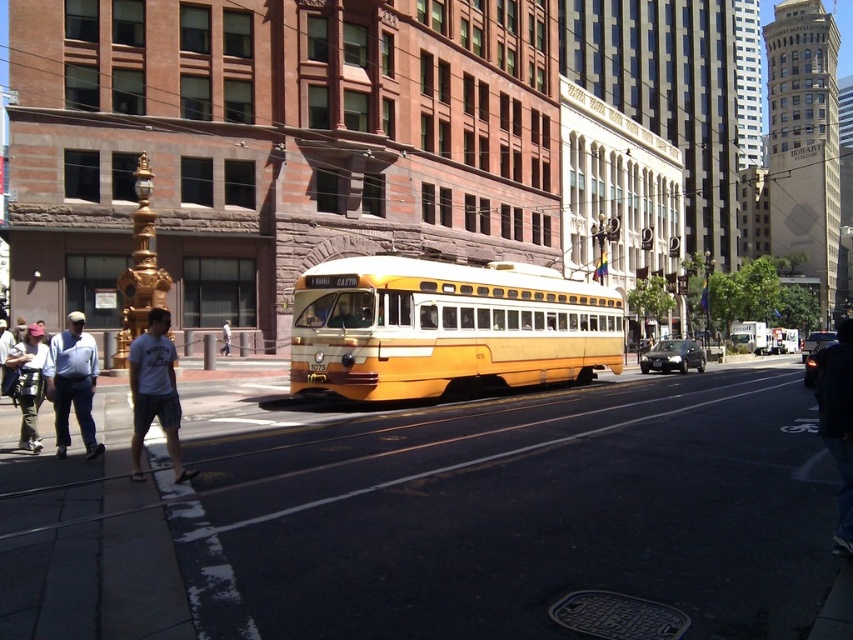
Question: Which of the following is the closest to the observer?

Choices:
 (A) yellow matte/satin school bus at center
 (B) white cotton t-shirt at left

Answer: (B)

Question: Which of the following is the closest to the observer?

Choices:
 (A) (225, 333)
 (B) (180, 468)

Answer: (B)

Question: Can you confirm if white cotton t-shirt at left is thinner than white cotton shirt at lower left?

Choices:
 (A) no
 (B) yes

Answer: (A)

Question: Which point appears closest to the camera in this image?

Choices:
 (A) (778, 340)
 (B) (32, 369)

Answer: (B)

Question: Is yellow matte/satin school bus at center to the left of white cotton t-shirt at left from the viewer's perspective?

Choices:
 (A) yes
 (B) no

Answer: (B)

Question: Is dark blue jeans at lower right to the right of yellow polished metal bus at center from the viewer's perspective?

Choices:
 (A) yes
 (B) no

Answer: (A)